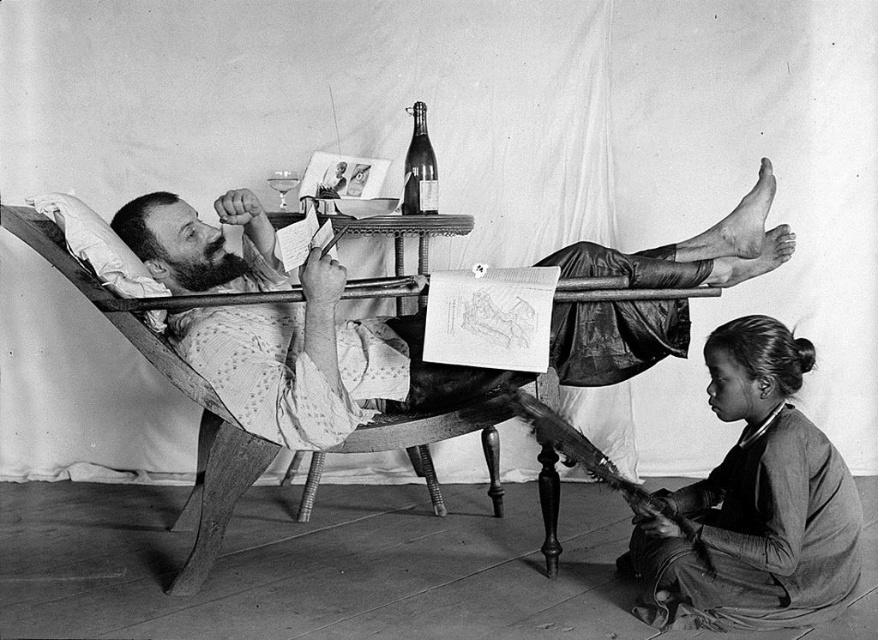
You are a photographer trying to frame a shot of the two objects at the center of the image, the spotted cotton shirt at center and the shiny glass bottle at center. You want to ensure that both objects are fully visible in the frame. Which object should you adjust the camera angle to prioritize keeping in the frame if space is limited?

The spotted cotton shirt at center has a larger width than the shiny glass bottle at center, so you should prioritize keeping the spotted cotton shirt at center in the frame to ensure it is fully visible.

You are analyzing the composition of the photograph and need to determine the position of the spotted cotton shirt at center relative to the white curtain in the background. Based on the coordinates provided, is the shirt closer to the top or bottom of the image?

The spotted cotton shirt at center is located at point coordinates with a y value of 0.363, which places it closer to the bottom of the image since lower y values correspond to positions nearer the bottom.

You are a photographer setting up a shoot in this scene. You want to ensure that the smooth dark fabric at lower right is visible in the final image. Given that the spotted cotton shirt at center is currently blocking it, what adjustment should you make to the camera angle or subject positioning?

The smooth dark fabric at lower right is behind the spotted cotton shirt at center, so to make the smooth dark fabric visible, you should adjust the camera angle to look around or below the spotted cotton shirt at center, or ask the subject to move the spotted cotton shirt at center slightly forward or to the side to reveal the smooth dark fabric at lower right.